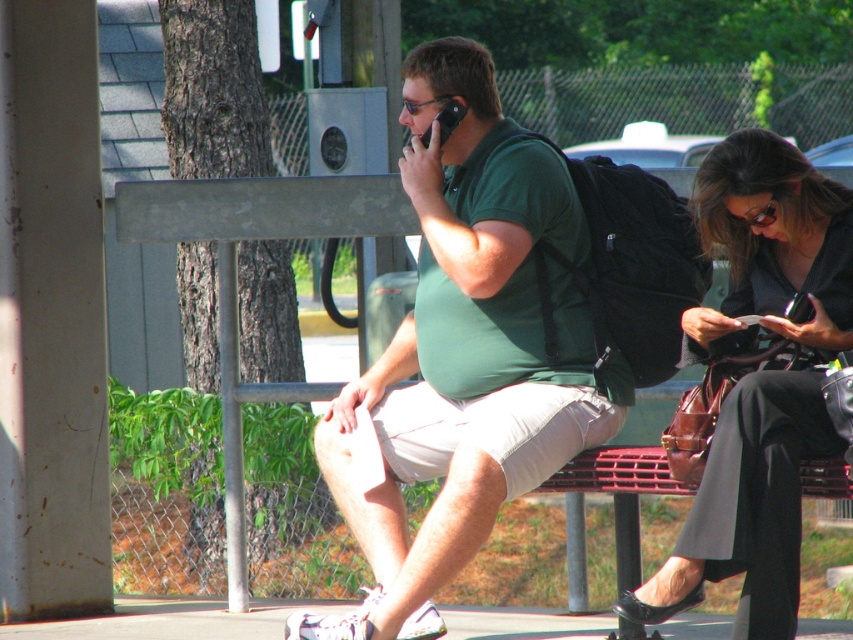
Can you confirm if green matte shirt at center is positioned to the right of black plastic phone at upper center?

Yes, green matte shirt at center is to the right of black plastic phone at upper center.

Is point (581, 291) closer to camera compared to point (438, 122)?

Yes, point (581, 291) is in front of point (438, 122).

The height and width of the screenshot is (640, 853). In order to click on green matte shirt at center in this screenshot , I will do `click(463, 353)`.

Is green matte shirt at center above matte brown purse at lower right?

Yes.

Is point (515, 326) closer to camera compared to point (846, 296)?

No, (515, 326) is behind (846, 296).

Identify the location of green matte shirt at center. The height and width of the screenshot is (640, 853). (463, 353).

Between matte brown purse at lower right and black plastic phone at upper center, which one is positioned higher?

Positioned higher is black plastic phone at upper center.

Does matte brown purse at lower right lie in front of black plastic phone at upper center?

Yes, it is.

Is point (741, 160) farther from viewer compared to point (419, 136)?

No, (741, 160) is in front of (419, 136).

Identify the location of matte brown purse at lower right. (759, 378).